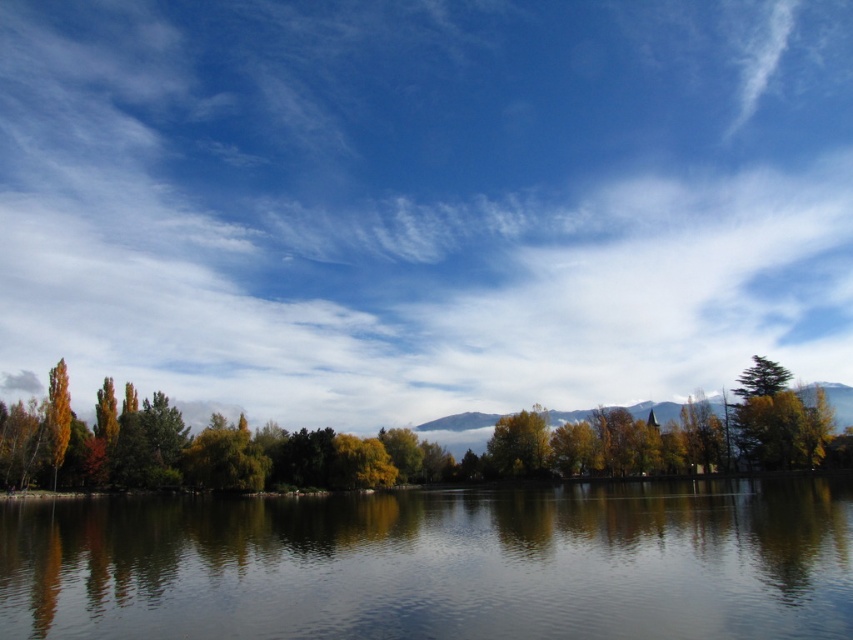
Can you confirm if white fluffy cloud at upper center is taller than orange matte tree at left?

Yes, white fluffy cloud at upper center is taller than orange matte tree at left.

Does white fluffy cloud at upper center appear over orange matte tree at left?

Indeed, white fluffy cloud at upper center is positioned over orange matte tree at left.

Is point (514, 259) less distant than point (59, 374)?

No.

The height and width of the screenshot is (640, 853). I want to click on white fluffy cloud at upper center, so click(x=422, y=200).

Which is above, golden yellow leaves at left or green leafy tree at center?

golden yellow leaves at left is above.

Between golden yellow leaves at left and green leafy tree at center, which one appears on the left side from the viewer's perspective?

From the viewer's perspective, green leafy tree at center appears more on the left side.

What do you see at coordinates (444, 449) in the screenshot? I see `golden yellow leaves at left` at bounding box center [444, 449].

Identify the location of golden yellow leaves at left. (444, 449).

The image size is (853, 640). What do you see at coordinates (439, 563) in the screenshot?
I see `glossy reflective water at center` at bounding box center [439, 563].

Which is behind, point (722, 611) or point (202, 429)?

Point (202, 429)

Describe the element at coordinates (439, 563) in the screenshot. I see `glossy reflective water at center` at that location.

Locate an element on the screen. Image resolution: width=853 pixels, height=640 pixels. glossy reflective water at center is located at coordinates (439, 563).